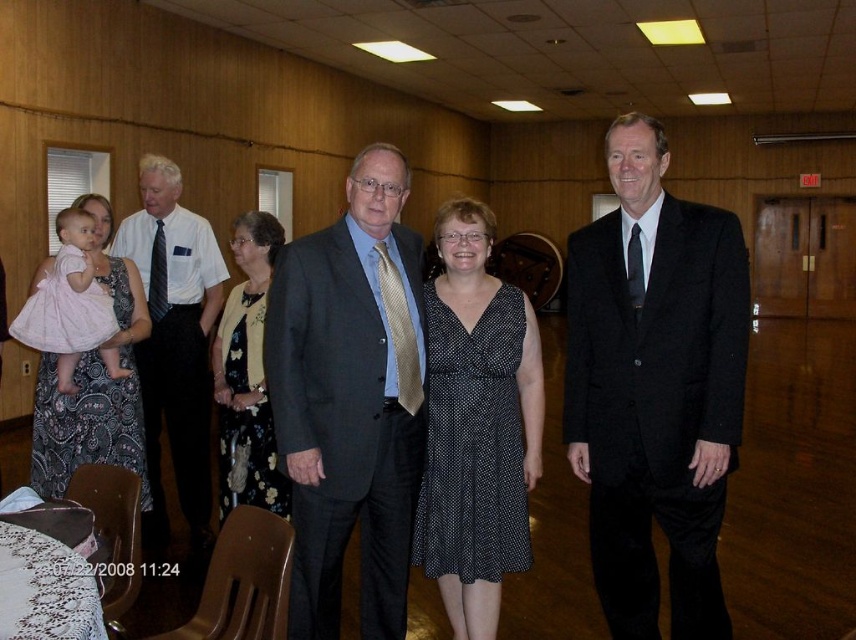
Identify the location of matte white shirt at center. The image size is (856, 640). (174, 339).

Does matte white shirt at center appear on the left side of pink satin dress at left?

In fact, matte white shirt at center is to the right of pink satin dress at left.

Locate an element on the screen. matte white shirt at center is located at coordinates (174, 339).

Is matte gray suit at center behind pink satin dress at left?

No, matte gray suit at center is in front of pink satin dress at left.

Where is `matte gray suit at center`? The image size is (856, 640). matte gray suit at center is located at coordinates (349, 400).

Between point (655, 289) and point (155, 496), which one is positioned in front?

Point (655, 289) is in front.

Is black wool suit at center wider than matte white shirt at center?

Incorrect, black wool suit at center's width does not surpass matte white shirt at center's.

Identify the location of black wool suit at center. (654, 387).